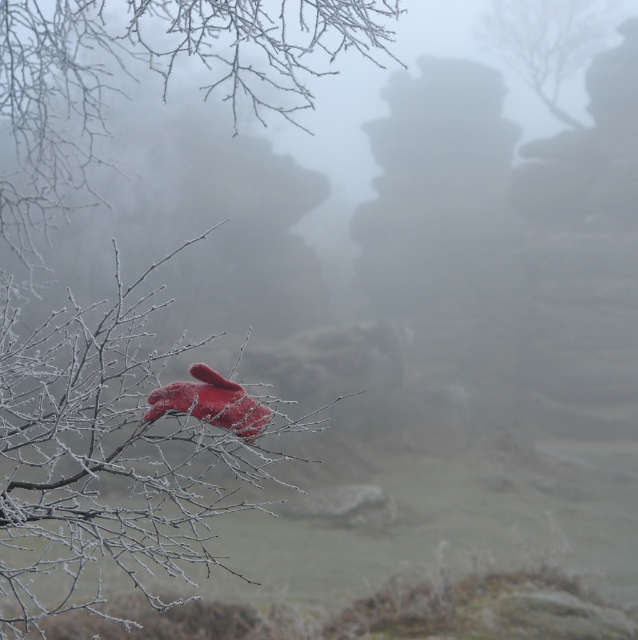
Looking at this image, between frosted branches at upper left and smooth bark tree at upper right, which one appears on the right side from the viewer's perspective?

Positioned to the right is smooth bark tree at upper right.

Who is more forward, [80,154] or [545,45]?

Point [80,154] is more forward.

Is point (154, 65) more distant than point (588, 33)?

No, (154, 65) is in front of (588, 33).

The height and width of the screenshot is (640, 638). Identify the location of frosted branches at upper left. (154, 72).